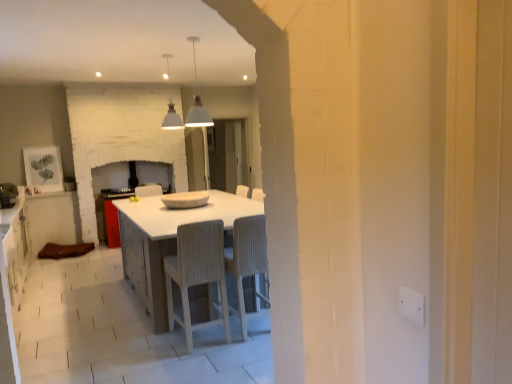
Question: Considering the relative positions of brushed metal oven at left and white textured chair at center, the second chair from the left, in the image provided, is brushed metal oven at left to the left of white textured chair at center, the second chair from the left, from the viewer's perspective?

Choices:
 (A) yes
 (B) no

Answer: (A)

Question: Is brushed metal oven at left turned away from white textured chair at center, the second chair from the left?

Choices:
 (A) no
 (B) yes

Answer: (A)

Question: Is brushed metal oven at left outside of white textured chair at center, marked as the first chair in a right-to-left arrangement?

Choices:
 (A) no
 (B) yes

Answer: (B)

Question: Could you tell me if brushed metal oven at left is facing white textured chair at center, marked as the first chair in a right-to-left arrangement?

Choices:
 (A) yes
 (B) no

Answer: (B)

Question: Is brushed metal oven at left at the right side of white textured chair at center, marked as the first chair in a right-to-left arrangement?

Choices:
 (A) no
 (B) yes

Answer: (A)

Question: Considering the positions of white matte pendant light at upper center, arranged as the second light fixture when viewed from the front, and white matte pendant lights at upper center, the first light fixture when ordered from right to left, in the image, is white matte pendant light at upper center, arranged as the second light fixture when viewed from the front, taller or shorter than white matte pendant lights at upper center, the first light fixture when ordered from right to left,?

Choices:
 (A) tall
 (B) short

Answer: (A)

Question: From the image's perspective, relative to white matte pendant lights at upper center, the first light fixture when ordered from right to left, is white matte pendant light at upper center, arranged as the first light fixture when viewed from the left, above or below?

Choices:
 (A) below
 (B) above

Answer: (B)

Question: Based on their sizes in the image, would you say white matte pendant light at upper center, which is the 2th light fixture in right-to-left order, is bigger or smaller than white matte pendant lights at upper center, marked as the second light fixture in a back-to-front arrangement?

Choices:
 (A) big
 (B) small

Answer: (A)

Question: From a real-world perspective, relative to white matte pendant lights at upper center, which is the 2th light fixture from left to right, is white matte pendant light at upper center, arranged as the second light fixture when viewed from the front, vertically above or below?

Choices:
 (A) below
 (B) above

Answer: (B)

Question: From the image's perspective, is matte brown cabinet at left above or below white ribbed chair at center, placed as the second chair when sorted from right to left?

Choices:
 (A) below
 (B) above

Answer: (B)

Question: Is point (75, 216) positioned closer to the camera than point (185, 241)?

Choices:
 (A) farther
 (B) closer

Answer: (A)

Question: Is matte brown cabinet at left bigger or smaller than white ribbed chair at center, placed as the second chair when sorted from right to left?

Choices:
 (A) big
 (B) small

Answer: (A)

Question: Looking at their shapes, would you say matte brown cabinet at left is wider or thinner than white ribbed chair at center, the first chair in the left-to-right sequence?

Choices:
 (A) thin
 (B) wide

Answer: (B)

Question: Is white textured chair at center, the second chair from the left, taller or shorter than white matte pendant light at upper center, the 1th light fixture when ordered from back to front?

Choices:
 (A) short
 (B) tall

Answer: (B)

Question: From a real-world perspective, is white textured chair at center, marked as the first chair in a right-to-left arrangement, positioned above or below white matte pendant light at upper center, arranged as the second light fixture when viewed from the front?

Choices:
 (A) below
 (B) above

Answer: (A)